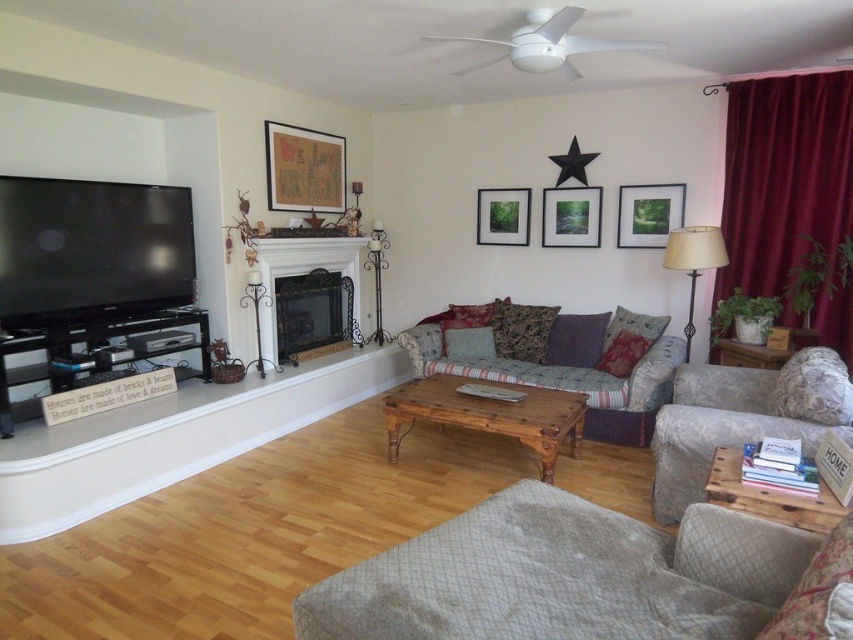
Question: Which point appears closest to the camera in this image?

Choices:
 (A) (746, 90)
 (B) (641, 422)

Answer: (B)

Question: Is the position of wooden tv stand at left less distant than that of matte glass picture frame at center?

Choices:
 (A) yes
 (B) no

Answer: (A)

Question: Where is floral fabric couch at center located in relation to matte wooden picture frame at center in the image?

Choices:
 (A) below
 (B) above

Answer: (A)

Question: Does gray fabric ottoman at lower center have a larger size compared to beige fabric lampshade at right?

Choices:
 (A) no
 (B) yes

Answer: (B)

Question: Which point is closer to the camera?

Choices:
 (A) floral fabric couch at center
 (B) matte green picture frame at upper right
 (C) gray fabric ottoman at lower center
 (D) velvet burgundy curtain at right

Answer: (C)

Question: Which point appears closest to the camera in this image?

Choices:
 (A) (276, 340)
 (B) (549, 424)
 (C) (486, 198)
 (D) (529, 481)

Answer: (D)